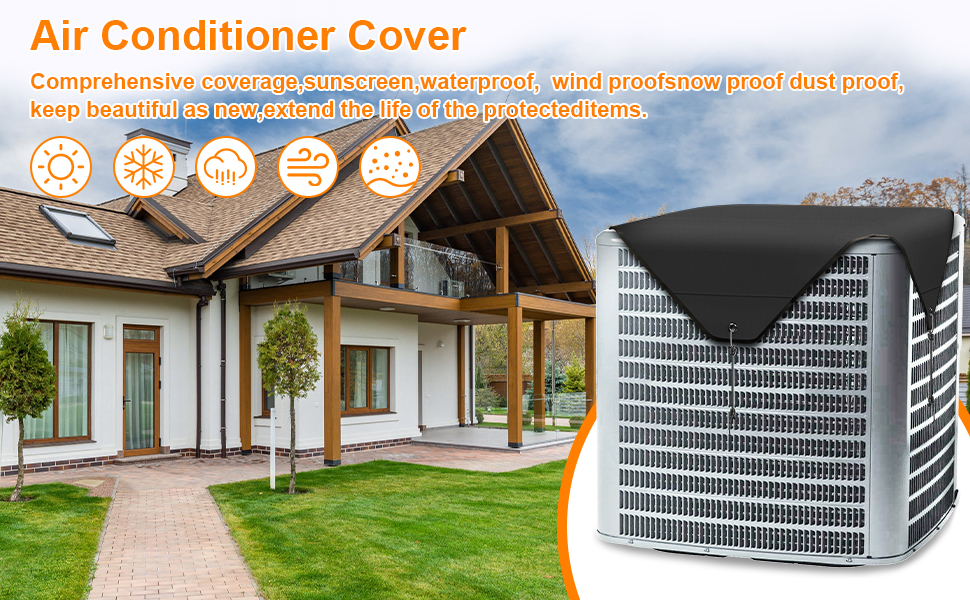
You are a GUI agent. You are given a task and a screenshot of the screen. Output one action in this format:
    pyautogui.click(x=<x>, y=<y>)
    Task: Click on the transom
    
    Given the screenshot: What is the action you would take?
    pyautogui.click(x=142, y=335)